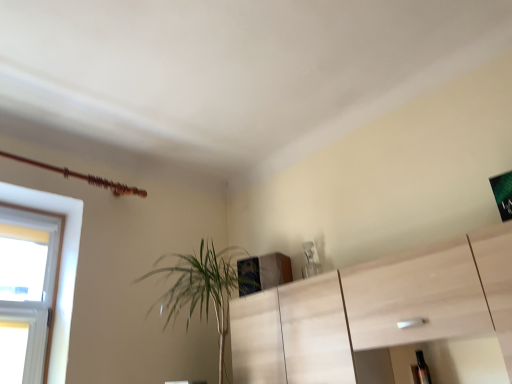
Question: Does transparent plastic bottle at lower right appear on the left side of green leafy plant at center-left?

Choices:
 (A) no
 (B) yes

Answer: (A)

Question: Is green leafy plant at center-left at the back of transparent plastic bottle at lower right?

Choices:
 (A) no
 (B) yes

Answer: (A)

Question: Considering the relative sizes of transparent plastic bottle at lower right and green leafy plant at center-left in the image provided, is transparent plastic bottle at lower right shorter than green leafy plant at center-left?

Choices:
 (A) yes
 (B) no

Answer: (A)

Question: Would you say transparent plastic bottle at lower right contains green leafy plant at center-left?

Choices:
 (A) yes
 (B) no

Answer: (B)

Question: Considering the relative sizes of transparent plastic bottle at lower right and green leafy plant at center-left in the image provided, is transparent plastic bottle at lower right thinner than green leafy plant at center-left?

Choices:
 (A) no
 (B) yes

Answer: (B)

Question: From a real-world perspective, is transparent plastic bottle at lower right on top of green leafy plant at center-left?

Choices:
 (A) yes
 (B) no

Answer: (B)

Question: Considering the relative positions of green leafy plant at center-left and transparent plastic bottle at lower right in the image provided, is green leafy plant at center-left to the right of transparent plastic bottle at lower right from the viewer's perspective?

Choices:
 (A) yes
 (B) no

Answer: (B)

Question: Is the position of green leafy plant at center-left more distant than that of transparent plastic bottle at lower right?

Choices:
 (A) no
 (B) yes

Answer: (A)

Question: Is green leafy plant at center-left not close to transparent plastic bottle at lower right?

Choices:
 (A) no
 (B) yes

Answer: (B)

Question: Does green leafy plant at center-left appear on the left side of transparent plastic bottle at lower right?

Choices:
 (A) yes
 (B) no

Answer: (A)

Question: Does green leafy plant at center-left contain transparent plastic bottle at lower right?

Choices:
 (A) yes
 (B) no

Answer: (B)

Question: From a real-world perspective, is green leafy plant at center-left on top of transparent plastic bottle at lower right?

Choices:
 (A) no
 (B) yes

Answer: (B)

Question: From the image's perspective, is transparent plastic bottle at lower right above or below green leafy plant at center-left?

Choices:
 (A) below
 (B) above

Answer: (A)